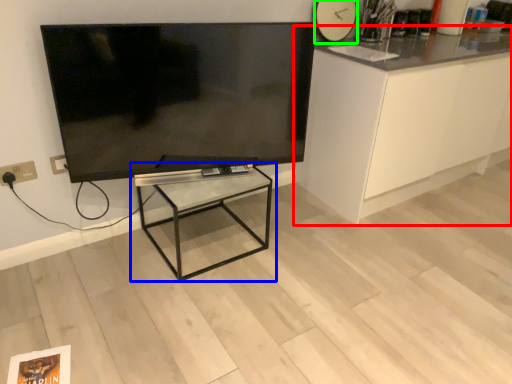
Question: Considering the real-world distances, which object is farthest from cabinetry (highlighted by a red box)? table (highlighted by a blue box) or clock (highlighted by a green box)?

Choices:
 (A) table
 (B) clock

Answer: (A)